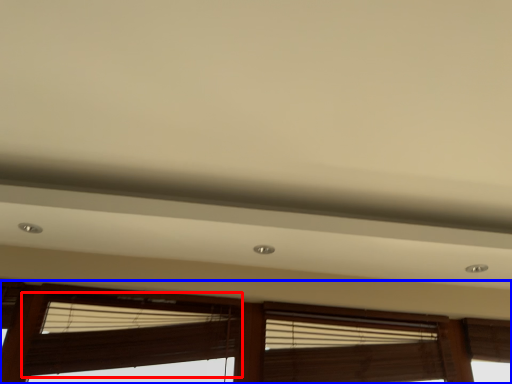
Question: Which point is closer to the camera, window blind (highlighted by a red box) or window (highlighted by a blue box)?

Choices:
 (A) window blind
 (B) window

Answer: (B)